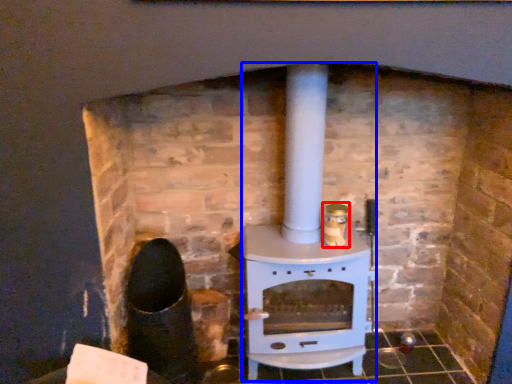
Question: Which object appears farthest to the camera in this image, appliance (highlighted by a red box) or wood burning stove (highlighted by a blue box)?

Choices:
 (A) appliance
 (B) wood burning stove

Answer: (A)